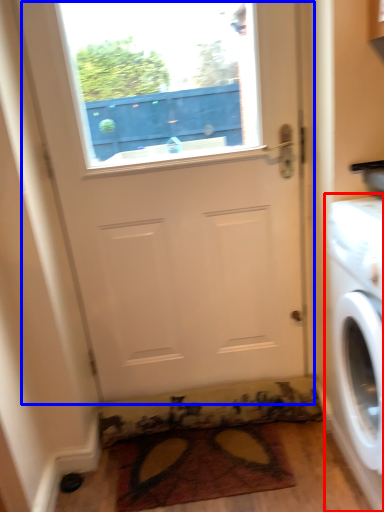
Question: Which object appears farthest to the camera in this image, washing machine (highlighted by a red box) or door (highlighted by a blue box)?

Choices:
 (A) washing machine
 (B) door

Answer: (B)